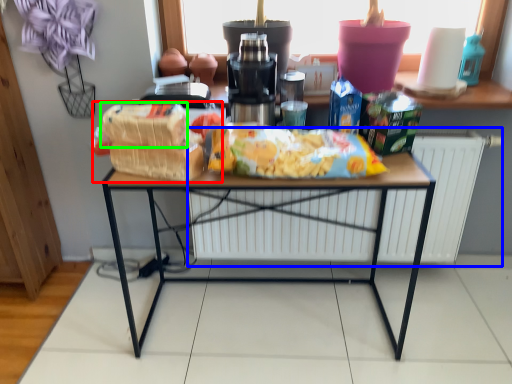
Question: Which object is positioned closest to snack (highlighted by a red box)? Select from radiator (highlighted by a blue box) and cereal (highlighted by a green box).

Choices:
 (A) radiator
 (B) cereal

Answer: (B)